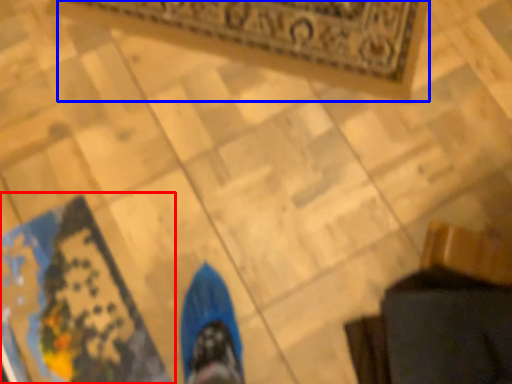
Question: Which of the following is the farthest to the observer, mat (highlighted by a red box) or mat (highlighted by a blue box)?

Choices:
 (A) mat
 (B) mat

Answer: (B)